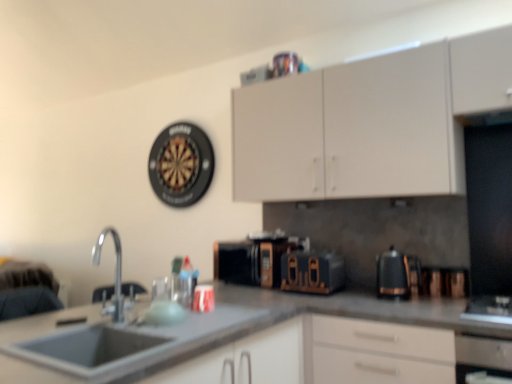
Where is `vacant region below black plastic coffee pot at right (from a real-world perspective)`? vacant region below black plastic coffee pot at right (from a real-world perspective) is located at coordinates (402, 292).